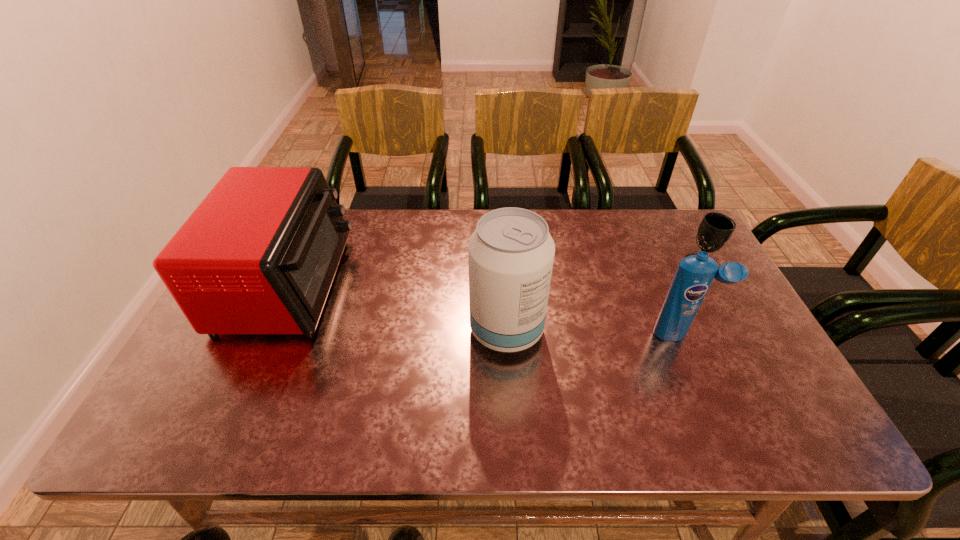
I want to click on alcohol, so click(x=511, y=253).

Identify the location of the second object from left to right. (511, 253).

Find the location of a particular element. This screenshot has height=540, width=960. shampoo is located at coordinates (694, 275).

The height and width of the screenshot is (540, 960). I want to click on toaster oven, so click(x=259, y=254).

Find the location of `the rightmost object`. the rightmost object is located at coordinates (715, 230).

Where is `chalice`? The image size is (960, 540). chalice is located at coordinates click(x=715, y=230).

Locate an element on the screen. The height and width of the screenshot is (540, 960). free space located 0.320m on the right of the tallest object is located at coordinates (667, 330).

This screenshot has width=960, height=540. I want to click on vacant space located 0.080m on the left of the third object from left to right, so click(621, 334).

Where is `free region located 0.120m on the front-facing side of the toaster oven`? The image size is (960, 540). free region located 0.120m on the front-facing side of the toaster oven is located at coordinates (386, 284).

In order to click on vacant space located on the front of the rightmost object in this screenshot , I will do `click(732, 322)`.